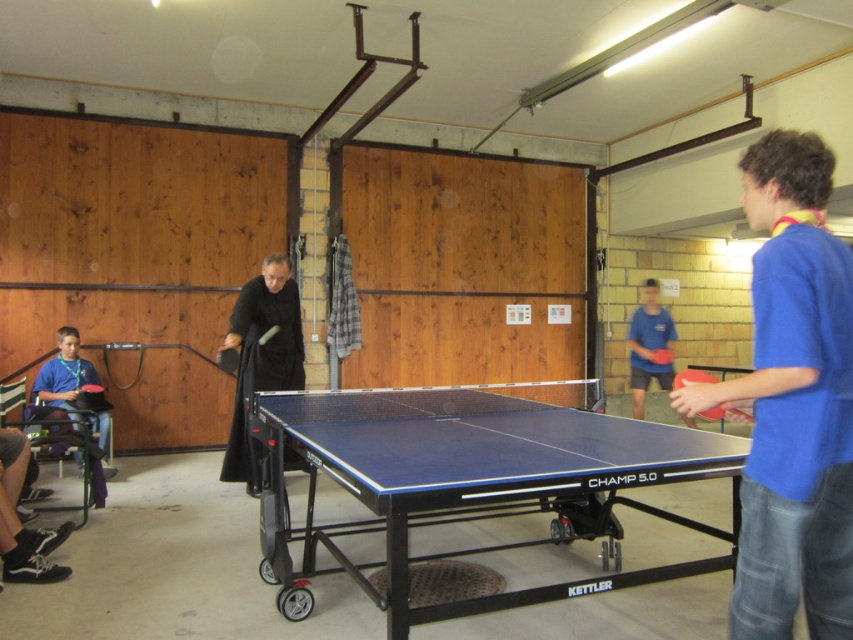
Does matte black shirt at left have a larger size compared to blue matte table tennis table at center?

Indeed, matte black shirt at left has a larger size compared to blue matte table tennis table at center.

Is matte black shirt at left smaller than blue matte table tennis table at center?

Actually, matte black shirt at left might be larger than blue matte table tennis table at center.

What do you see at coordinates (64, 372) in the screenshot? Image resolution: width=853 pixels, height=640 pixels. I see `matte black shirt at left` at bounding box center [64, 372].

Identify the location of matte black shirt at left. This screenshot has height=640, width=853. (64, 372).

How far apart are blue cotton shirt at right and black matte/velvet robe at center?

blue cotton shirt at right and black matte/velvet robe at center are 3.00 meters apart from each other.

Who is higher up, blue cotton shirt at right or black matte/velvet robe at center?

blue cotton shirt at right

Is point (796, 372) closer to viewer compared to point (235, 396)?

That is True.

This screenshot has width=853, height=640. I want to click on blue cotton shirt at right, so click(792, 401).

Describe the element at coordinates (260, 355) in the screenshot. I see `black matte/velvet robe at center` at that location.

Is point (260, 310) in front of point (85, 387)?

Yes, point (260, 310) is closer to viewer.

At what (x,y) coordinates should I click in order to perform the action: click on black matte/velvet robe at center. Please return your answer as a coordinate pair (x, y). This screenshot has height=640, width=853. Looking at the image, I should click on (260, 355).